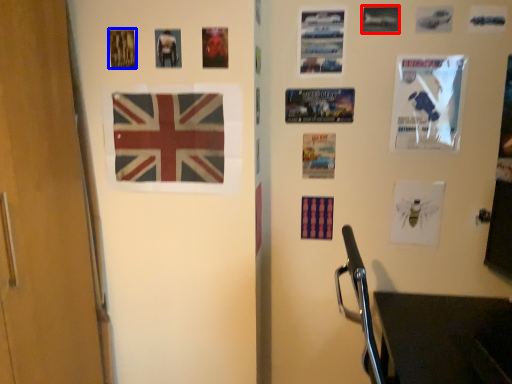
Question: Among these objects, which one is nearest to the camera, poster page (highlighted by a red box) or poster page (highlighted by a blue box)?

Choices:
 (A) poster page
 (B) poster page

Answer: (B)